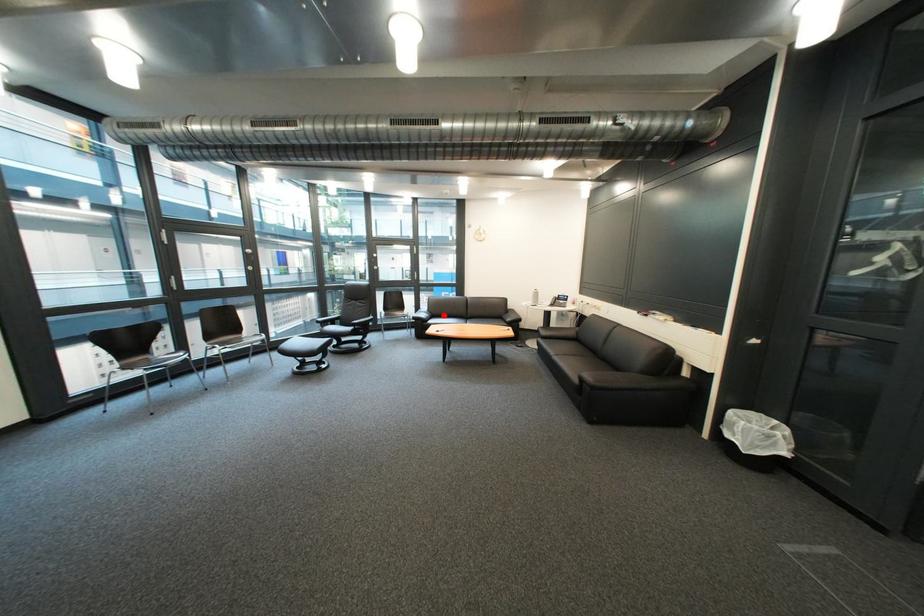
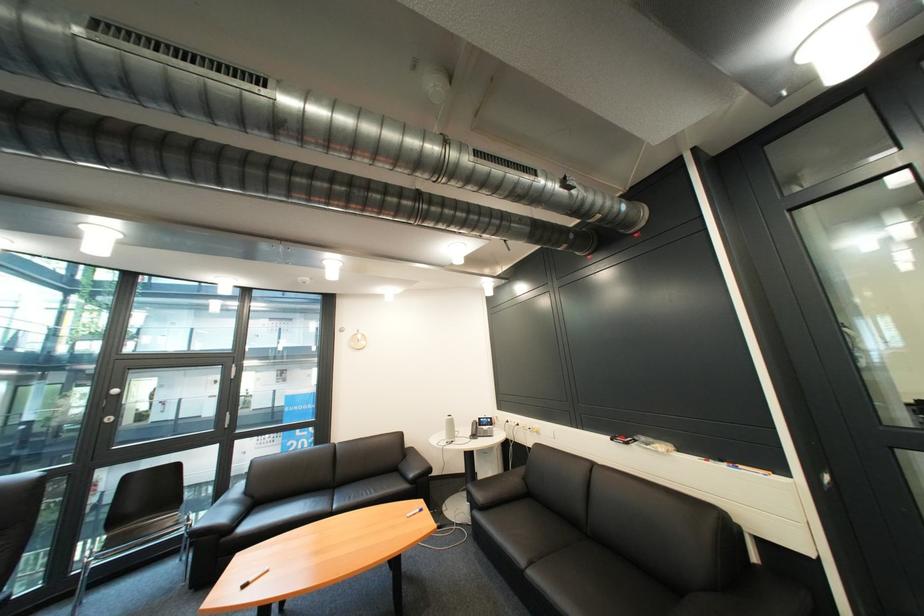
Locate, in the second image, the point that corresponds to the highlighted location in the first image.

(262, 503)